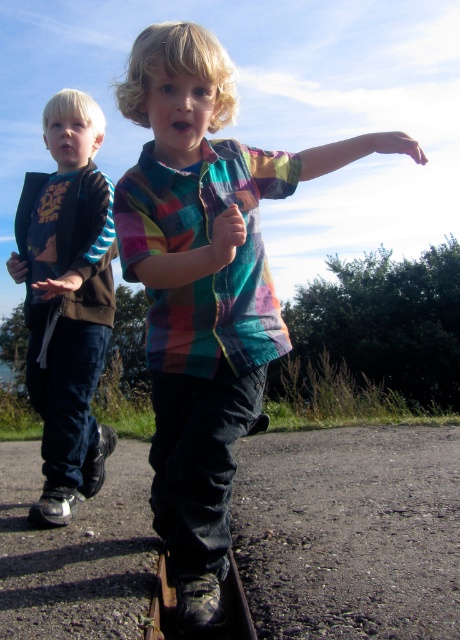
Question: Which object is closer to the camera taking this photo?

Choices:
 (A) matte black jacket at left
 (B) multicolored fabric arm at center
 (C) multicolored fabric shirt at center
 (D) multicolored plaid shirt at center

Answer: (C)

Question: Which object is the closest to the multicolored fabric shirt at center?

Choices:
 (A) matte black jacket at left
 (B) multicolored fabric arm at center
 (C) multicolored plaid shirt at center

Answer: (C)

Question: Where is multicolored plaid shirt at center located in relation to matte black hoodie at left in the image?

Choices:
 (A) left
 (B) right

Answer: (B)

Question: Does multicolored plaid shirt at center have a lesser width compared to matte black hoodie at left?

Choices:
 (A) no
 (B) yes

Answer: (A)

Question: Is multicolored plaid shirt at center further to the viewer compared to matte black hoodie at left?

Choices:
 (A) yes
 (B) no

Answer: (B)

Question: Which point is closer to the camera?

Choices:
 (A) (90, 305)
 (B) (39, 260)
 (C) (143, 60)

Answer: (C)